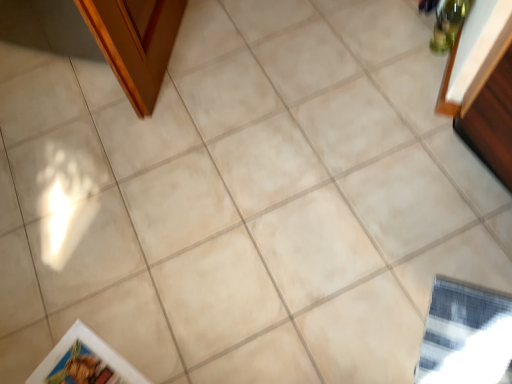
This screenshot has width=512, height=384. What do you see at coordinates (448, 24) in the screenshot?
I see `green glass bottle at upper right` at bounding box center [448, 24].

Locate an element on the screen. green glass bottle at upper right is located at coordinates (448, 24).

Image resolution: width=512 pixels, height=384 pixels. Identify the location of green glass bottle at upper right. (448, 24).